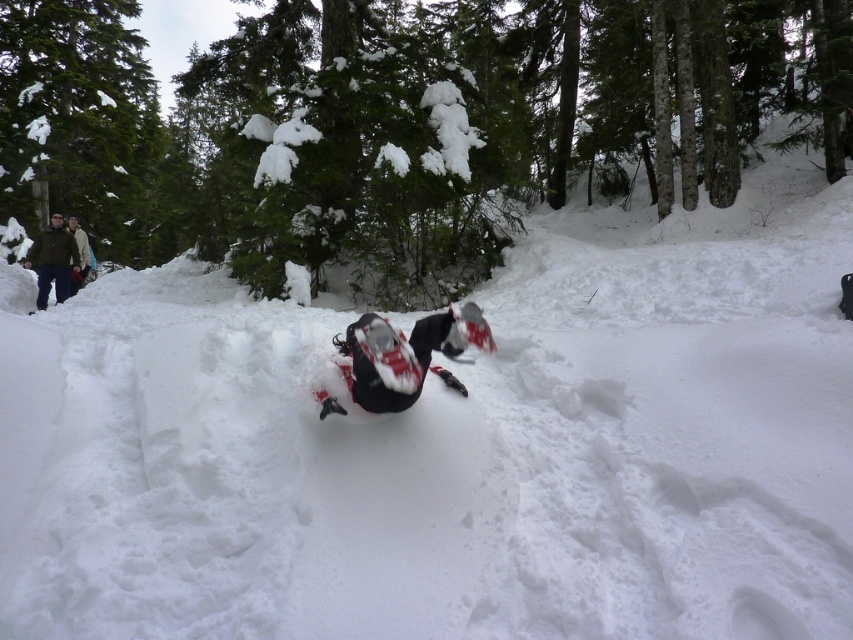
You are a hiker lost in the snowy forest and see the red matte snowmobile at center. Can you estimate its position relative to your current location based on the coordinates provided?

The red matte snowmobile at center is located at coordinates point (405, 355), which means it is positioned slightly to the right and above your current position if you are at the origin point.

You are a hiker trying to decide whether to take the red matte snowmobile at center or the tan wool jacket at upper left with you on a short trip. Based on their sizes, which one can you more easily carry?

The red matte snowmobile at center is shorter than the tan wool jacket at upper left, so the red matte snowmobile at center is smaller and easier to carry.

You are a hiker who needs to retrieve your jacket from the tan wool jacket at upper left. The red matte snowmobile at center is blocking your path. Can you go around it to reach your jacket?

The red matte snowmobile at center is positioned under the tan wool jacket at upper left, so the snowmobile is closer to you than the jacket. You can go around the snowmobile to reach the jacket since it is not directly in front of it.